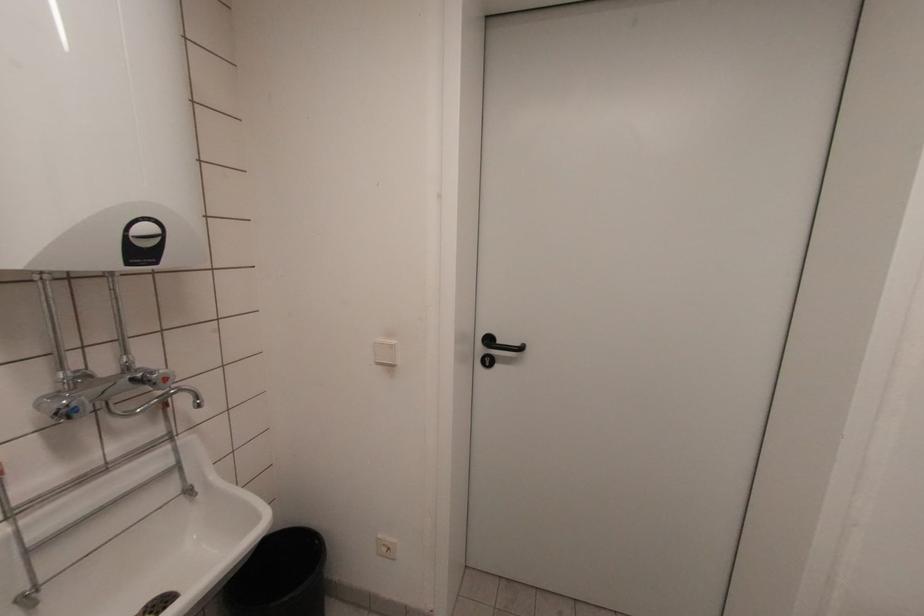
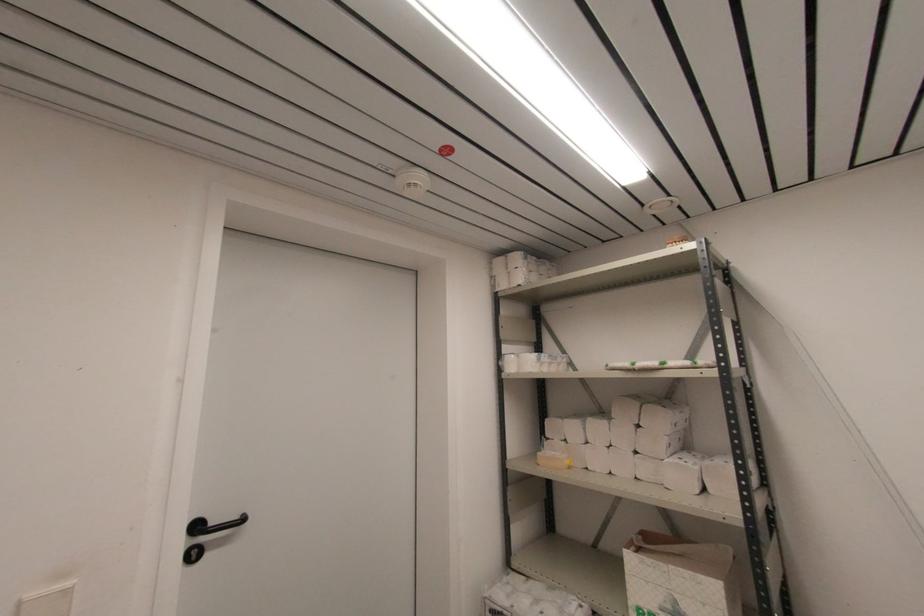
Question: The camera is either moving clockwise (left) or counter-clockwise (right) around the object. The first image is from the beginning of the video and the second image is from the end. Is the camera moving left or right when shooting the video?

Choices:
 (A) Left
 (B) Right

Answer: (A)